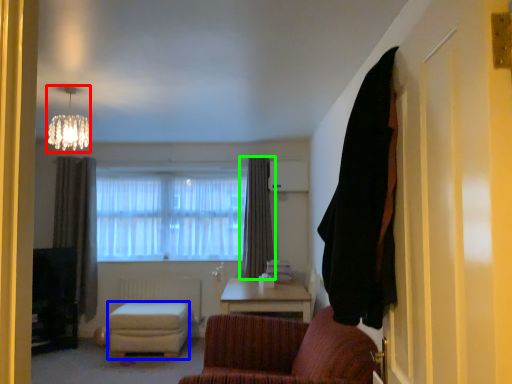
Question: Considering the real-world distances, which object is farthest from lamp (highlighted by a red box)? stool (highlighted by a blue box) or curtain (highlighted by a green box)?

Choices:
 (A) stool
 (B) curtain

Answer: (B)